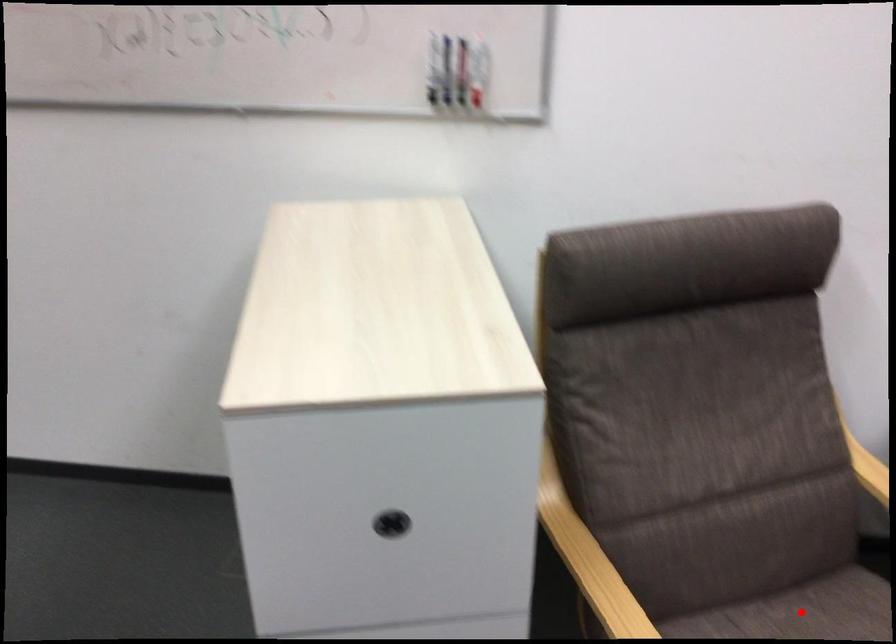
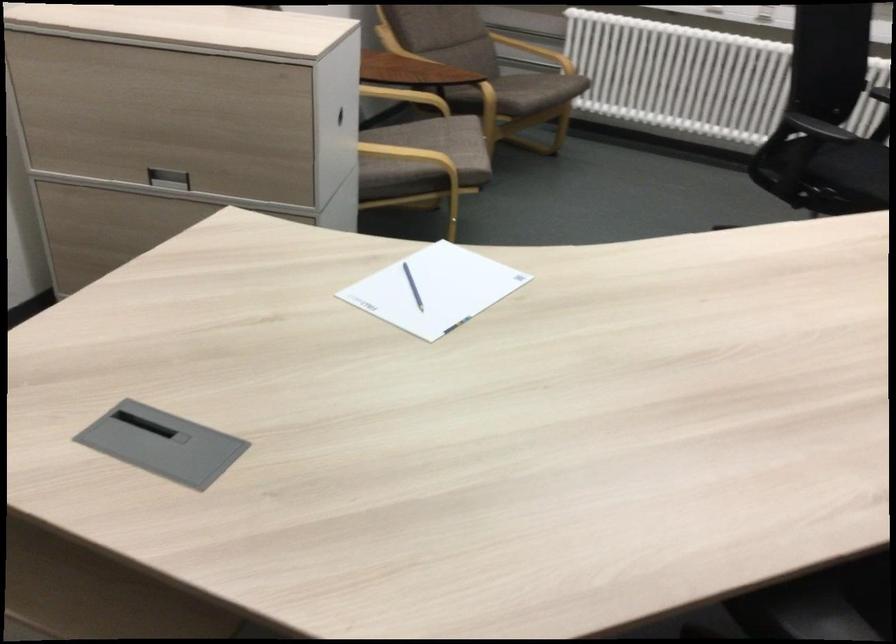
Question: I am providing you with two images of the same scene from different viewpoints. A red point is marked on the first image. Can you still see the location of the red point in image 2?

Choices:
 (A) Yes
 (B) No

Answer: (B)